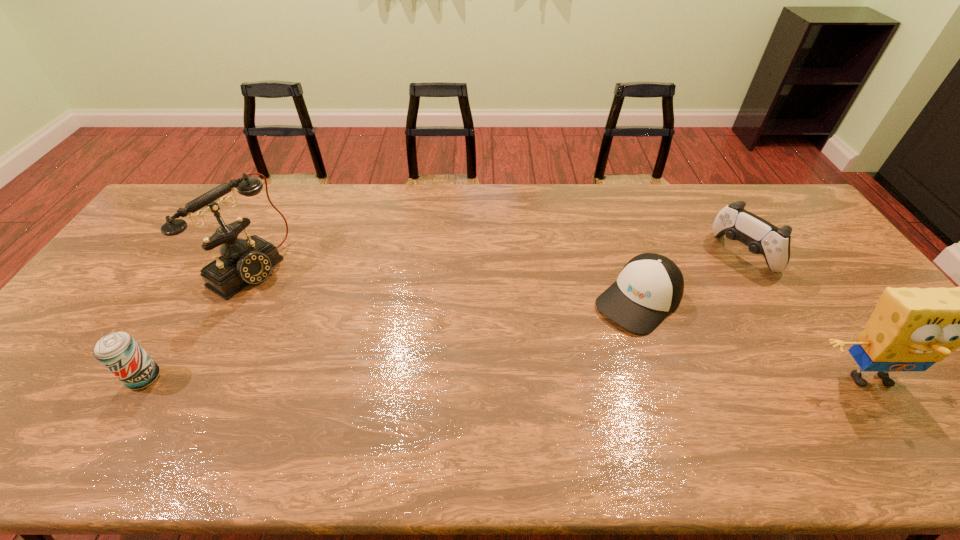
Where is `vacant position located 0.170m on the front-facing side of the control`? Image resolution: width=960 pixels, height=540 pixels. vacant position located 0.170m on the front-facing side of the control is located at coordinates (690, 292).

The height and width of the screenshot is (540, 960). Find the location of `free region located on the front-facing side of the control`. free region located on the front-facing side of the control is located at coordinates (659, 314).

Image resolution: width=960 pixels, height=540 pixels. Find the location of `free space located 0.380m on the dial of the telephone`. free space located 0.380m on the dial of the telephone is located at coordinates (366, 343).

Image resolution: width=960 pixels, height=540 pixels. I want to click on free space located 0.150m on the dial of the telephone, so click(x=303, y=307).

Where is `free location located on the dial of the telephone`? free location located on the dial of the telephone is located at coordinates (363, 341).

Identify the location of beer can at the near edge. click(x=119, y=352).

What are the coordinates of `sponge at the near edge` in the screenshot? It's located at (911, 329).

What are the coordinates of `object that is at the right edge` in the screenshot? It's located at (911, 329).

Find the location of a particular element. The image size is (960, 540). object present at the near right corner is located at coordinates (911, 329).

Locate an element on the screen. free space at the far edge of the desktop is located at coordinates (393, 225).